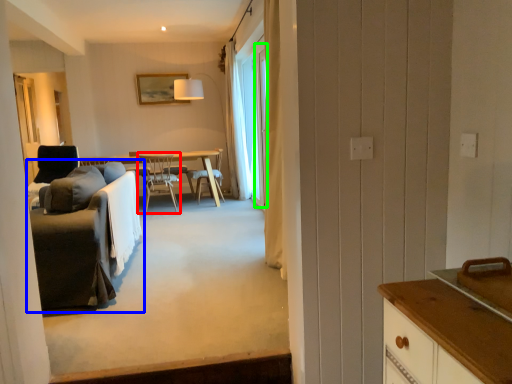
Question: Which object is the farthest from chair (highlighted by a red box)? Choose among these: studio couch (highlighted by a blue box) or window (highlighted by a green box).

Choices:
 (A) studio couch
 (B) window

Answer: (A)